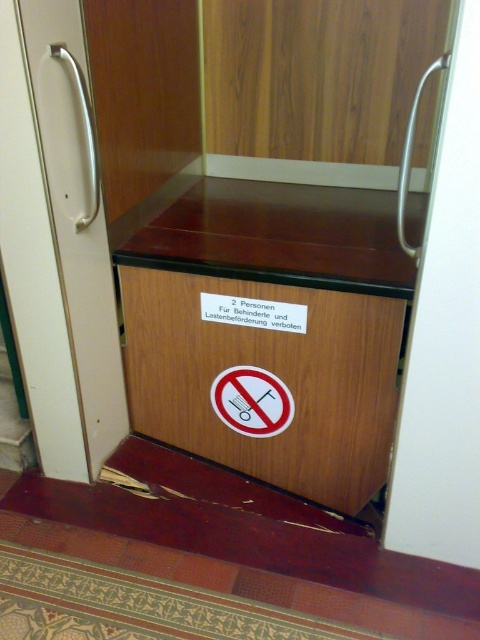
Between wooden drawer at center and white glossy door handle at left, which one is positioned lower?

wooden drawer at center

Can you confirm if wooden drawer at center is positioned below white glossy door handle at left?

Yes.

Locate an element on the screen. wooden drawer at center is located at coordinates (265, 378).